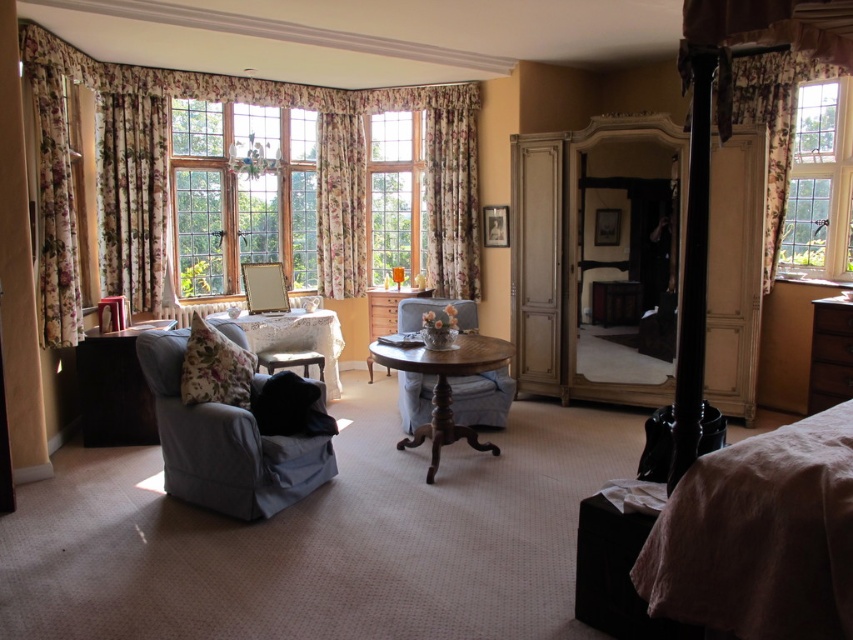
Question: Is blue cotton couch at lower left bigger than brown wooden dresser at right?

Choices:
 (A) no
 (B) yes

Answer: (B)

Question: Considering the real-world distances, which object is farthest from the brown linen bed at lower right?

Choices:
 (A) velvet blue armchair at center
 (B) floral fabric curtain at left

Answer: (B)

Question: Which of the following is the farthest from the observer?

Choices:
 (A) pyautogui.click(x=837, y=346)
 (B) pyautogui.click(x=746, y=54)
 (C) pyautogui.click(x=381, y=362)
 (D) pyautogui.click(x=276, y=259)

Answer: (D)

Question: Is the position of floral fabric curtain at upper center more distant than that of wooden round table at center?

Choices:
 (A) no
 (B) yes

Answer: (B)

Question: Among these points, which one is farthest from the camera?

Choices:
 (A) (375, 294)
 (B) (840, 99)

Answer: (A)

Question: From the image, what is the correct spatial relationship of floral fabric curtain at center in relation to wooden round table at center?

Choices:
 (A) below
 (B) above

Answer: (B)